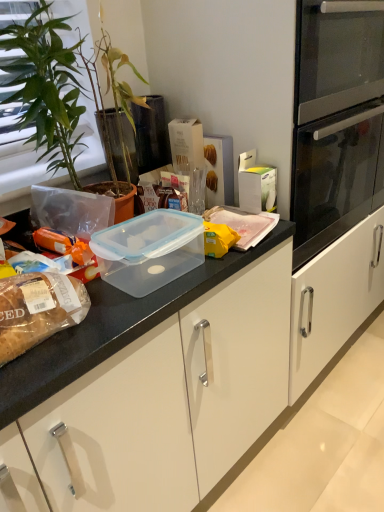
Question: Is green leafy plant at left inside translucent plastic container at center, the 1th food when ordered from top to bottom?

Choices:
 (A) no
 (B) yes

Answer: (A)

Question: Can you confirm if translucent plastic container at center, which appears as the 2th food when viewed from the left, is positioned to the left of green leafy plant at left?

Choices:
 (A) yes
 (B) no

Answer: (B)

Question: Is translucent plastic container at center, the 1th food when ordered from top to bottom, aimed at green leafy plant at left?

Choices:
 (A) yes
 (B) no

Answer: (B)

Question: Is translucent plastic container at center, the first food when ordered from right to left, located outside green leafy plant at left?

Choices:
 (A) no
 (B) yes

Answer: (B)

Question: Is the depth of translucent plastic container at center, the 1th food when ordered from top to bottom, less than that of green leafy plant at left?

Choices:
 (A) yes
 (B) no

Answer: (B)

Question: Considering the relative positions of translucent plastic container at center, the 1th food when ordered from top to bottom, and green leafy plant at left in the image provided, is translucent plastic container at center, the 1th food when ordered from top to bottom, behind green leafy plant at left?

Choices:
 (A) yes
 (B) no

Answer: (A)

Question: Is transparent plastic container at center not close to transparent plastic container at upper center?

Choices:
 (A) yes
 (B) no

Answer: (B)

Question: From a real-world perspective, is transparent plastic container at center located beneath transparent plastic container at upper center?

Choices:
 (A) no
 (B) yes

Answer: (B)

Question: From the image's perspective, would you say transparent plastic container at center is shown under transparent plastic container at upper center?

Choices:
 (A) yes
 (B) no

Answer: (A)

Question: Is transparent plastic container at center completely or partially outside of transparent plastic container at upper center?

Choices:
 (A) no
 (B) yes

Answer: (B)

Question: Is transparent plastic container at center touching transparent plastic container at upper center?

Choices:
 (A) no
 (B) yes

Answer: (A)

Question: Is transparent plastic container at center oriented away from transparent plastic container at upper center?

Choices:
 (A) no
 (B) yes

Answer: (A)

Question: Is transparent plastic container at center looking in the opposite direction of translucent plastic container at center, which is the second food from front to back?

Choices:
 (A) yes
 (B) no

Answer: (B)